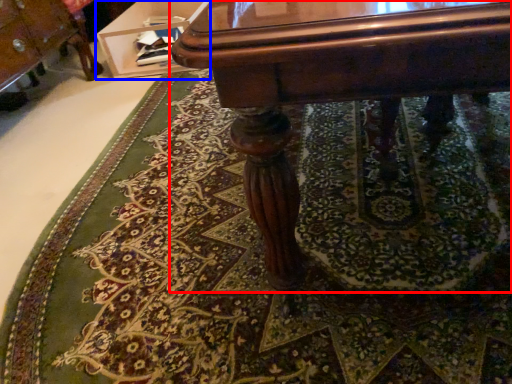
Question: Which point is closer to the camera, table (highlighted by a red box) or vanity (highlighted by a blue box)?

Choices:
 (A) table
 (B) vanity

Answer: (A)